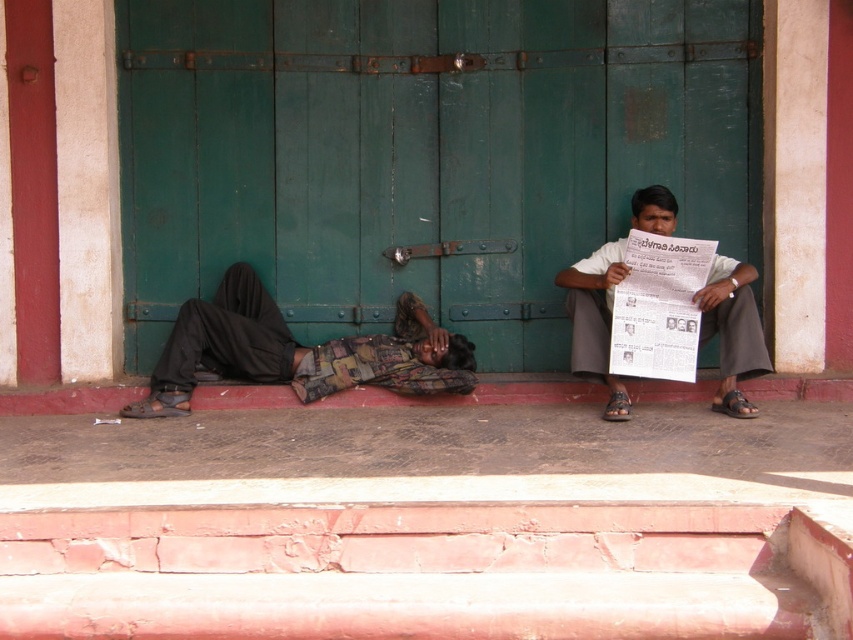
You are standing at the point labeled as point (x=746, y=112) and want to take a photo of the green door. The camera you have can only focus on objects within 7 meters. Will the camera be able to capture the green door clearly?

The distance between point (x=746, y=112) and the camera is 6.99 meters, which is within the camera focus range of 7 meters. Therefore, the camera can capture the green door clearly.